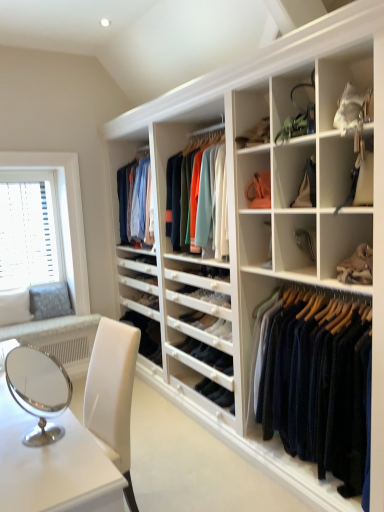
Question: In which direction should I rotate to look at white matte shelf at center, marked as the second shelf in a bottom-to-top arrangement?

Choices:
 (A) left
 (B) right

Answer: (B)

Question: From a real-world perspective, is white plastic blinds at left under navy wool sweater at center?

Choices:
 (A) yes
 (B) no

Answer: (B)

Question: Is the position of white plastic blinds at left less distant than that of navy wool sweater at center?

Choices:
 (A) yes
 (B) no

Answer: (B)

Question: Does white plastic blinds at left have a larger size compared to navy wool sweater at center?

Choices:
 (A) yes
 (B) no

Answer: (B)

Question: Is white plastic blinds at left looking in the opposite direction of navy wool sweater at center?

Choices:
 (A) no
 (B) yes

Answer: (A)

Question: Does white plastic blinds at left appear on the left side of navy wool sweater at center?

Choices:
 (A) no
 (B) yes

Answer: (B)

Question: From the image's perspective, does white plastic blinds at left appear higher than navy wool sweater at center?

Choices:
 (A) yes
 (B) no

Answer: (A)

Question: Is matte green handbag at upper right, the 1th shelf from the top, in front of white plastic blinds at left?

Choices:
 (A) no
 (B) yes

Answer: (B)

Question: Can you confirm if matte green handbag at upper right, the 1th shelf from the top, is positioned to the right of white plastic blinds at left?

Choices:
 (A) no
 (B) yes

Answer: (B)

Question: From a real-world perspective, is matte green handbag at upper right, which appears as the 4th shelf when ordered from the bottom, on white plastic blinds at left?

Choices:
 (A) no
 (B) yes

Answer: (B)

Question: From the image's perspective, is matte green handbag at upper right, the 1th shelf from the top, located beneath white plastic blinds at left?

Choices:
 (A) no
 (B) yes

Answer: (A)

Question: From a real-world perspective, is matte green handbag at upper right, the 1th shelf from the top, positioned under white plastic blinds at left based on gravity?

Choices:
 (A) yes
 (B) no

Answer: (B)

Question: Is matte green handbag at upper right, which appears as the 4th shelf when ordered from the bottom, smaller than white plastic blinds at left?

Choices:
 (A) no
 (B) yes

Answer: (B)

Question: Is white plastic blinds at left smaller than leather handbag at center right, the first shelf positioned from the bottom?

Choices:
 (A) yes
 (B) no

Answer: (B)